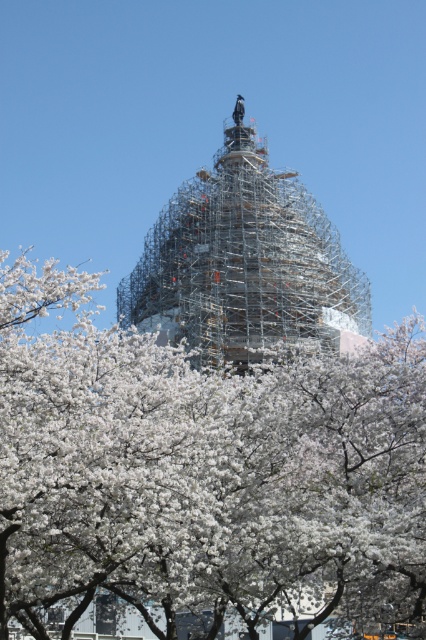
You are an architect visiting the construction site. You see the white blossoms at center and the scaffolding at center. Which object is positioned to the right side from your viewpoint?

The scaffolding at center is positioned to the right side of the white blossoms at center.